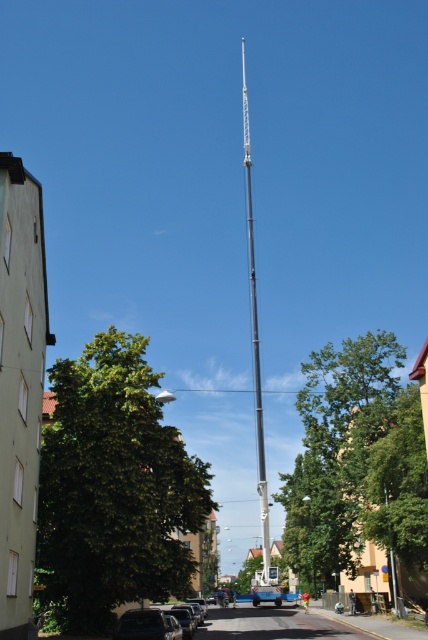
In the scene shown: Can you confirm if metallic gray mast at center is positioned above shiny silver car at lower left?

Indeed, metallic gray mast at center is positioned over shiny silver car at lower left.

Is point (267, 576) behind point (151, 616)?

Yes.

The height and width of the screenshot is (640, 428). In order to click on metallic gray mast at center in this screenshot , I will do `click(255, 339)`.

Where is `metallic gray mast at center`? This screenshot has width=428, height=640. metallic gray mast at center is located at coordinates (255, 339).

Does green concrete building at left have a lesser height compared to shiny silver car at lower left?

No, green concrete building at left is not shorter than shiny silver car at lower left.

Between green concrete building at left and shiny silver car at lower left, which one has more height?

green concrete building at left

Measure the distance between green concrete building at left and camera.

21.48 meters

Where is `green concrete building at left`? green concrete building at left is located at coordinates (20, 387).

How distant is green concrete building at left from metallic gray mast at center?

green concrete building at left and metallic gray mast at center are 65.43 meters apart.

Is point (8, 280) closer to viewer compared to point (267, 580)?

That is True.

At what (x,y) coordinates should I click in order to perform the action: click on green concrete building at left. Please return your answer as a coordinate pair (x, y). This screenshot has height=640, width=428. Looking at the image, I should click on pyautogui.click(x=20, y=387).

This screenshot has height=640, width=428. In order to click on green concrete building at left in this screenshot , I will do `click(20, 387)`.